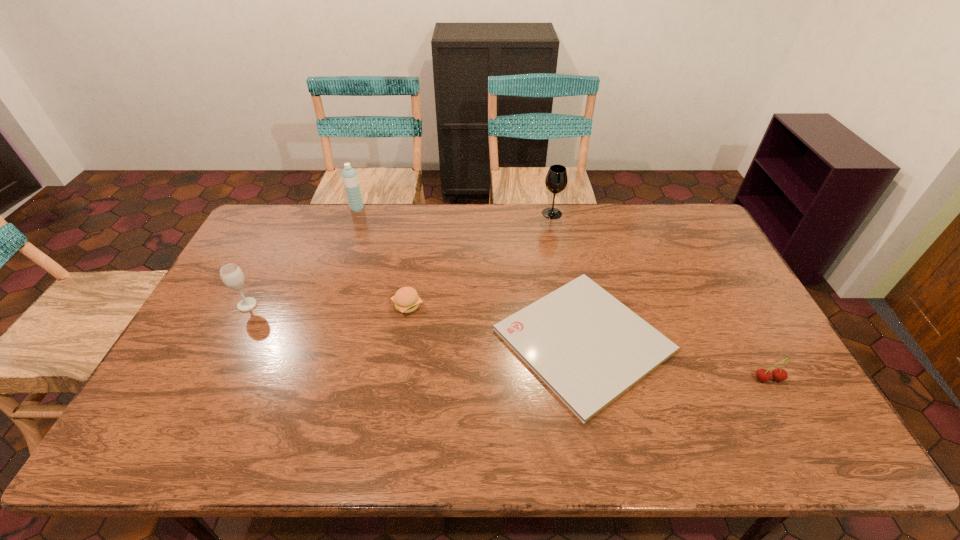
I want to click on the fifth object from right to left, so click(349, 175).

Locate an element on the screen. The height and width of the screenshot is (540, 960). the farther wineglass is located at coordinates (556, 179).

At what (x,y) coordinates should I click in order to perform the action: click on the taller wineglass. Please return your answer as a coordinate pair (x, y). Looking at the image, I should click on coord(556,179).

Where is `the third tallest object`? the third tallest object is located at coordinates (232, 276).

This screenshot has height=540, width=960. I want to click on the left wineglass, so click(232, 276).

At what (x,y) coordinates should I click in order to perform the action: click on cherry. Please return your answer as a coordinate pair (x, y). This screenshot has height=540, width=960. Looking at the image, I should click on (763, 375).

Identify the location of the fourth tallest object. (763, 375).

This screenshot has width=960, height=540. I want to click on the fifth tallest object, so click(406, 299).

What are the coordinates of `hamburger` in the screenshot? It's located at (406, 299).

The image size is (960, 540). In order to click on the shortest object in this screenshot , I will do `click(585, 345)`.